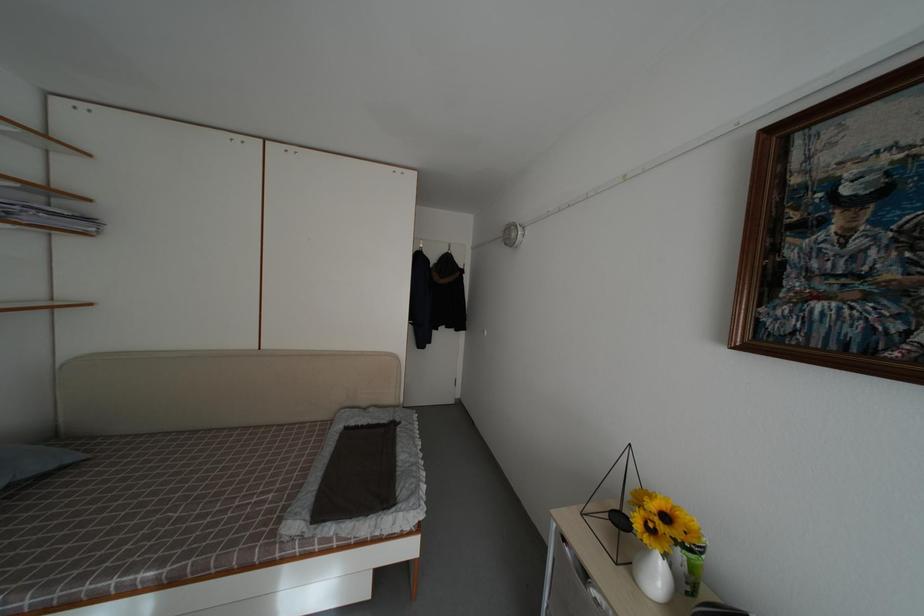
Where would you lift the white vase? Please return your answer as a coordinate pair (x, y).

(652, 575)